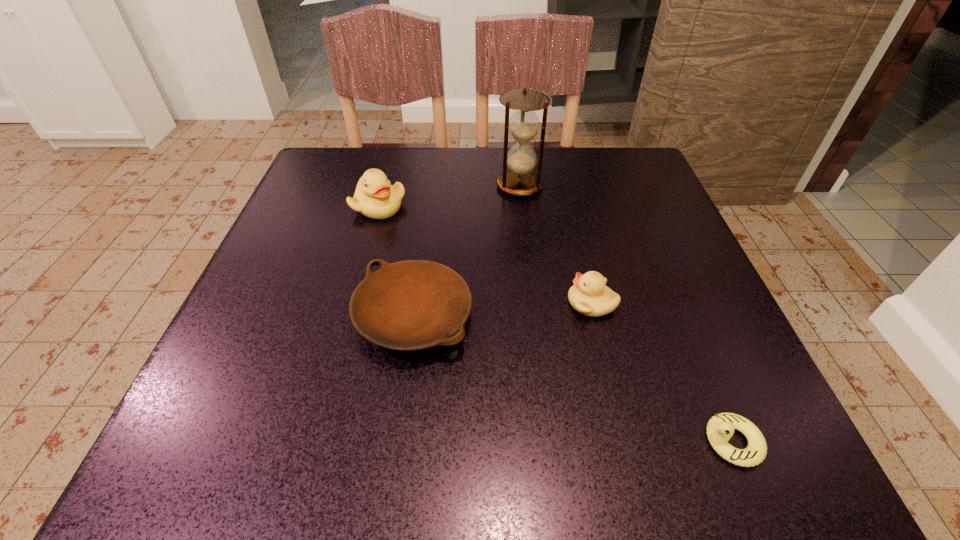
At what (x,y) coordinates should I click in order to perform the action: click on vacant region located on the front-facing side of the second tallest object. Please return your answer as a coordinate pair (x, y). Looking at the image, I should click on (338, 357).

Where is `free spot located on the beak of the second nearest duckling`? This screenshot has width=960, height=540. free spot located on the beak of the second nearest duckling is located at coordinates (418, 303).

The height and width of the screenshot is (540, 960). Identify the location of blank space located on the beak of the second nearest duckling. coord(521,303).

You are a GUI agent. You are given a task and a screenshot of the screen. Output one action in this format:
    pyautogui.click(x=<x>, y=<y>)
    Task: Click on the vacant space located 0.190m on the beak of the second nearest duckling
    The image size is (960, 540).
    Given the screenshot: What is the action you would take?
    pyautogui.click(x=458, y=303)

Image resolution: width=960 pixels, height=540 pixels. Find the location of `free region located on the front of the plate`. free region located on the front of the plate is located at coordinates (400, 414).

Find the location of `vacant space positioned 0.200m on the face of the shortest duckling`. vacant space positioned 0.200m on the face of the shortest duckling is located at coordinates (551, 442).

The width and height of the screenshot is (960, 540). What are the coordinates of `free spot located on the face of the shortest duckling` in the screenshot? It's located at [544, 442].

Locate an element on the screen. free space located 0.250m on the face of the shortest duckling is located at coordinates (514, 442).

Locate an element on the screen. This screenshot has height=540, width=960. hourglass that is at the far edge is located at coordinates (524, 124).

I want to click on duckling present at the far edge, so click(375, 197).